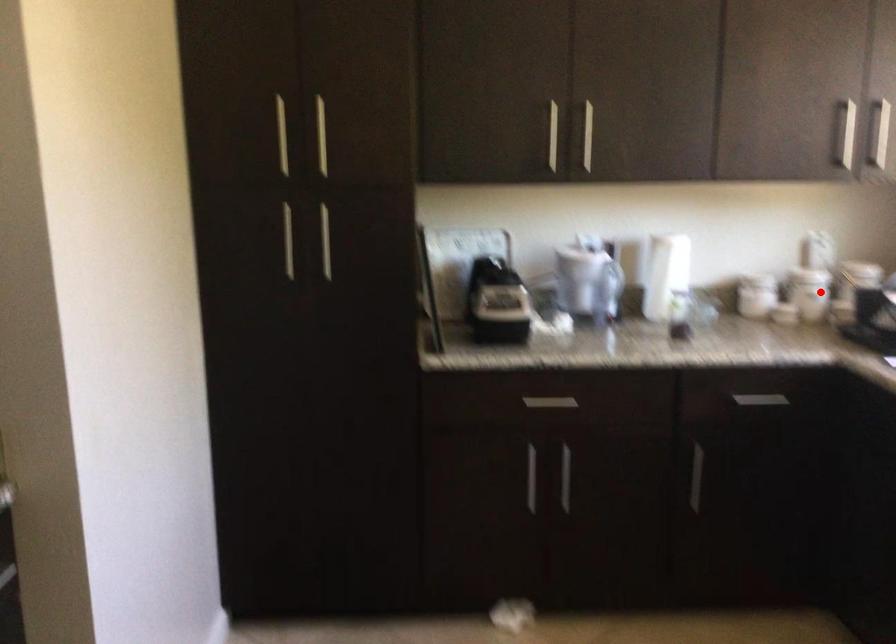
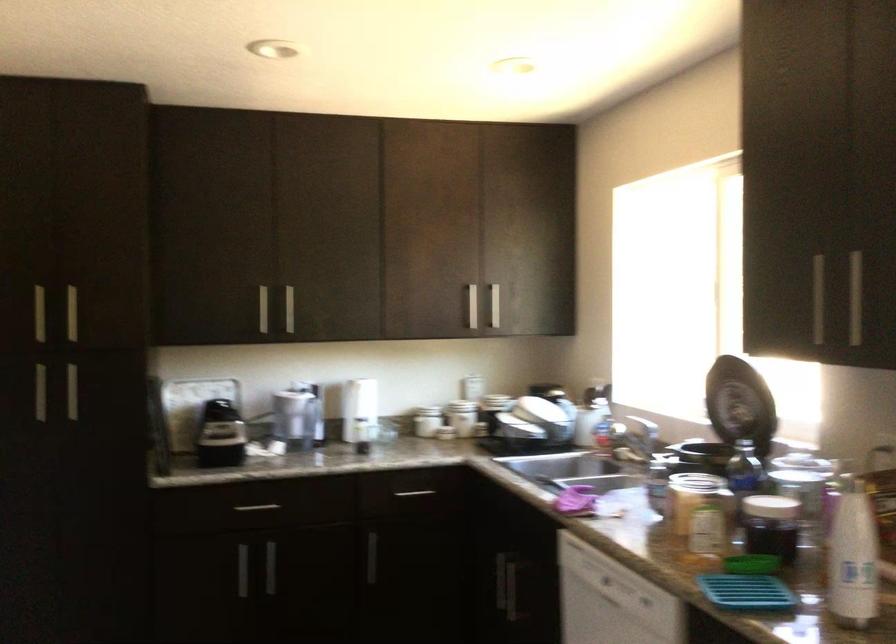
Question: A red point is marked in image1. In image2, is the corresponding 3D point closer to the camera or farther? Reply with the corresponding letter.

Choices:
 (A) The corresponding 3D point is closer.
 (B) The corresponding 3D point is farther.

Answer: (B)